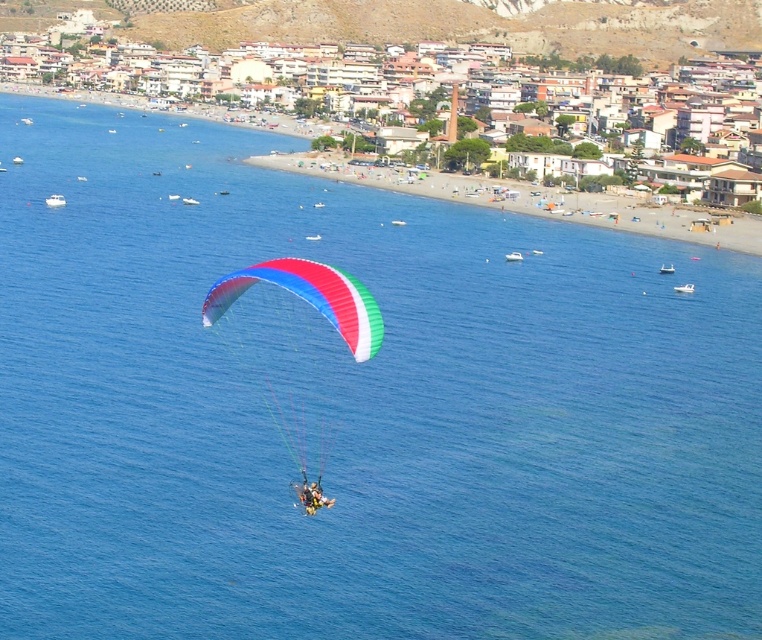
Between point (223, 312) and point (296, 486), which one is positioned in front?

Point (296, 486)

Between multicolored fabric parachute at center and yellow fabric parachute at center, which one has less height?

yellow fabric parachute at center is shorter.

What are the coordinates of `multicolored fabric parachute at center` in the screenshot? It's located at (296, 346).